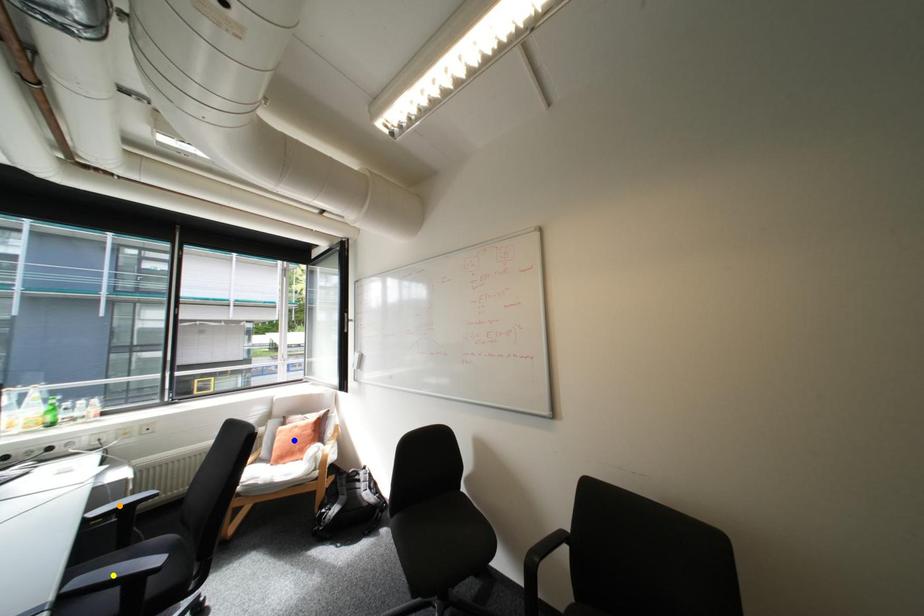
Order these from nearest to farthest:
orange point, blue point, yellow point

blue point
orange point
yellow point